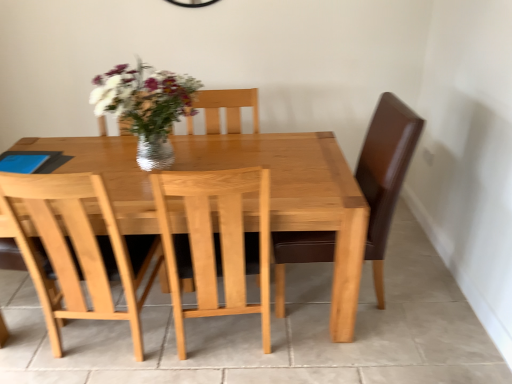
Find the location of a particular element. Image resolution: width=512 pixels, height=384 pixels. free point behind shiny silver vase at center is located at coordinates (182, 146).